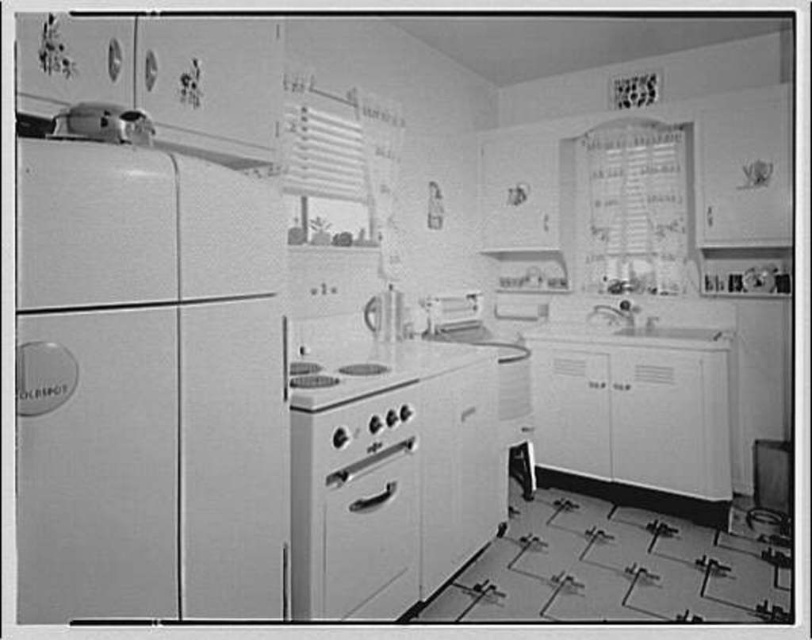
Which of these two, white glossy oven at center or white glossy stove at center, stands taller?

Standing taller between the two is white glossy oven at center.

Is white glossy oven at center further to the viewer compared to white glossy stove at center?

Yes, white glossy oven at center is behind white glossy stove at center.

Between point (327, 579) and point (335, 381), which one is positioned behind?

Positioned behind is point (335, 381).

I want to click on white glossy oven at center, so click(x=355, y=506).

Which is in front, point (169, 339) or point (350, 589)?

Point (169, 339)

Describe the element at coordinates (148, 387) in the screenshot. I see `white matte refrigerator at left` at that location.

What do you see at coordinates (148, 387) in the screenshot? The height and width of the screenshot is (640, 812). I see `white matte refrigerator at left` at bounding box center [148, 387].

What are the coordinates of `white matte refrigerator at left` in the screenshot? It's located at (148, 387).

Which is behind, point (205, 170) or point (344, 397)?

The point (344, 397) is more distant.

Can you confirm if white matte refrigerator at left is shorter than white glossy stove at center?

No, white matte refrigerator at left is not shorter than white glossy stove at center.

Is point (141, 275) closer to viewer compared to point (333, 394)?

Yes, point (141, 275) is in front of point (333, 394).

Find the location of a particular element. The height and width of the screenshot is (640, 812). white matte refrigerator at left is located at coordinates (148, 387).